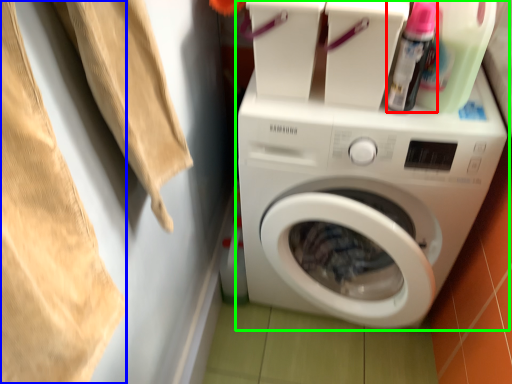
Question: Based on their relative distances, which object is farther from cleaning product (highlighted by a red box)? Choose from clothing (highlighted by a blue box) and washing machine (highlighted by a green box).

Choices:
 (A) clothing
 (B) washing machine

Answer: (A)